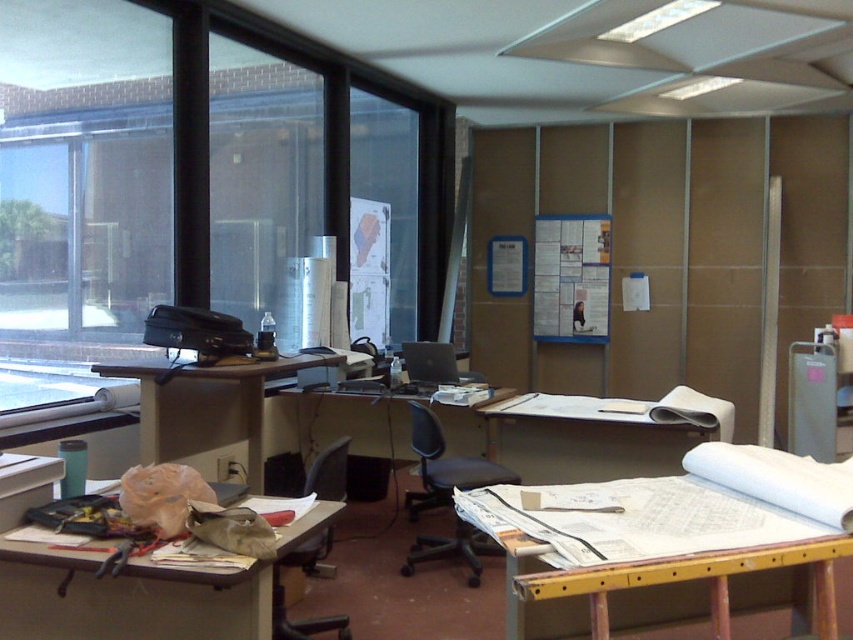
Question: Which point is closer to the camera taking this photo?

Choices:
 (A) (281, 632)
 (B) (364, 422)

Answer: (A)

Question: Does wooden drafting table at center appear over wooden desk at lower left?

Choices:
 (A) yes
 (B) no

Answer: (B)

Question: Which point is farther to the camera?

Choices:
 (A) (425, 362)
 (B) (277, 134)
 (C) (140, 438)

Answer: (B)

Question: Which of these objects is positioned closest to the matte black printer at center?

Choices:
 (A) wooden drafting table at center
 (B) matte plastic desk at center
 (C) transparent glass window at upper left
 (D) matte brown desk at center

Answer: (D)

Question: Can you confirm if transparent glass window at upper left is smaller than black mesh swivel chair at center?

Choices:
 (A) yes
 (B) no

Answer: (B)

Question: Is wooden desk at lower left below matte plastic desk at center?

Choices:
 (A) yes
 (B) no

Answer: (A)